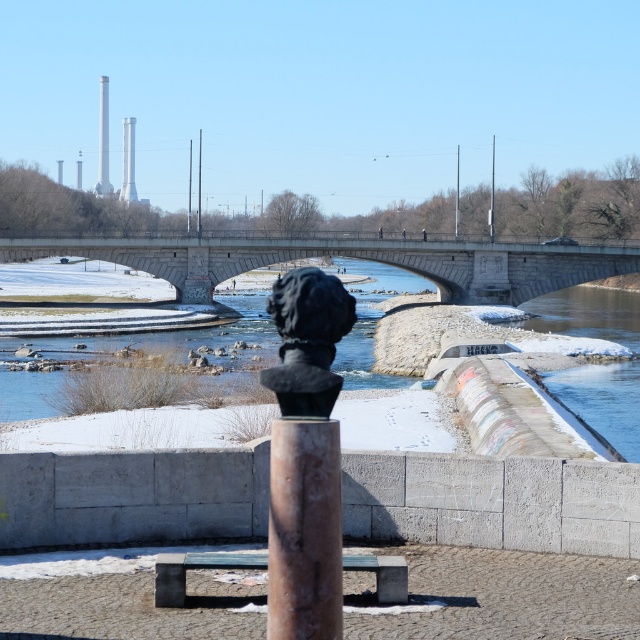
Question: In this image, where is stone bridge at center located relative to rustic concrete bench at center?

Choices:
 (A) right
 (B) left

Answer: (B)

Question: Which point is closer to the camera taking this photo?

Choices:
 (A) (81, 253)
 (B) (282, 292)
 (C) (129, 188)

Answer: (B)

Question: Is stone bridge at center smaller than rustic concrete bench at center?

Choices:
 (A) yes
 (B) no

Answer: (B)

Question: Which point is farther to the camera?

Choices:
 (A) smooth concrete pillar at upper center
 (B) rusty metal pole at center
 (C) rustic concrete bench at center

Answer: (A)

Question: Which of these objects is positioned closest to the rusty metal pole at center?

Choices:
 (A) smooth concrete pillar at upper center
 (B) stone bridge at center

Answer: (B)

Question: Is rusty metal pole at center bigger than black polished stone bust at center?

Choices:
 (A) no
 (B) yes

Answer: (A)